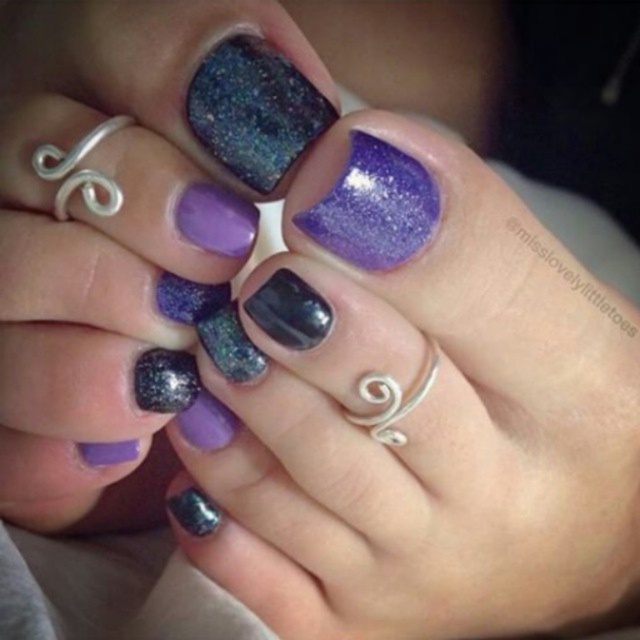
You are a nail technician observing the hands. You need to apply a new layer of clear topcoat to both the glittery metallic nail polish at center and the sparkly black nail polish at center. Which nail polish should you work on first to avoid smudging the one underneath?

You should work on the glittery metallic nail polish at center first because it is in front of the sparkly black nail polish at center. This way, you can apply the topcoat to the front nail polish without accidentally smudging the one behind it.

You are a photographer trying to capture the best angle of the nail art. You notice two points on the hands marked as point (x=266, y=264) and point (x=184, y=513). Which point should you focus on first to ensure the nail art is in sharp focus?

Point (x=266, y=264) is in front of point (x=184, y=513), so focusing on point (x=266, y=264) first will ensure the nail art is in sharp focus since it is closer to the camera.

You are a nail technician and want to apply a new coat of glitter polish to the purple glitter nail at center. If your brush is 12 inches long, can you reach the nail without moving your hand?

The purple glitter nail at center and viewer are 14.17 inches apart. Since the brush is 12 inches long, it is shorter than the distance to the nail. Therefore, you cannot reach the nail without moving your hand.